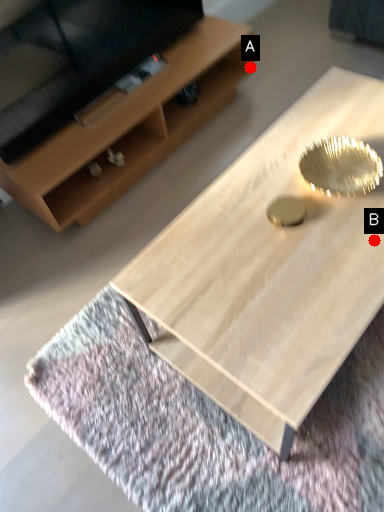
Question: Two points are circled on the image, labeled by A and B beside each circle. Among these points, which one is farthest from the camera?

Choices:
 (A) A is further
 (B) B is further

Answer: (A)